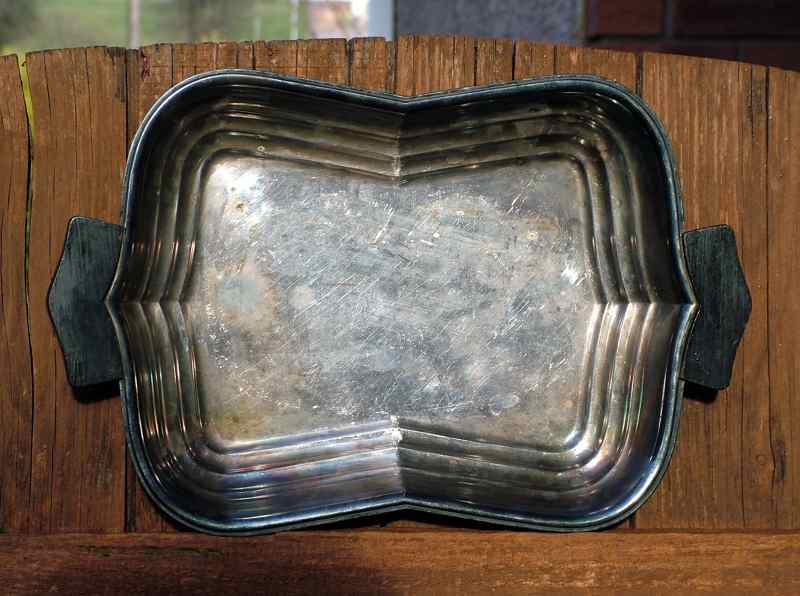
Identify the location of table. The image size is (800, 596). (50, 443).